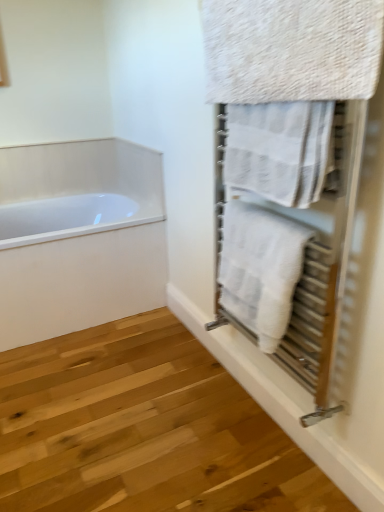
The width and height of the screenshot is (384, 512). In order to click on free spot below textured beige towel at upper right, the third towel from the bottom (from a real-world perspective) in this screenshot , I will do `click(263, 436)`.